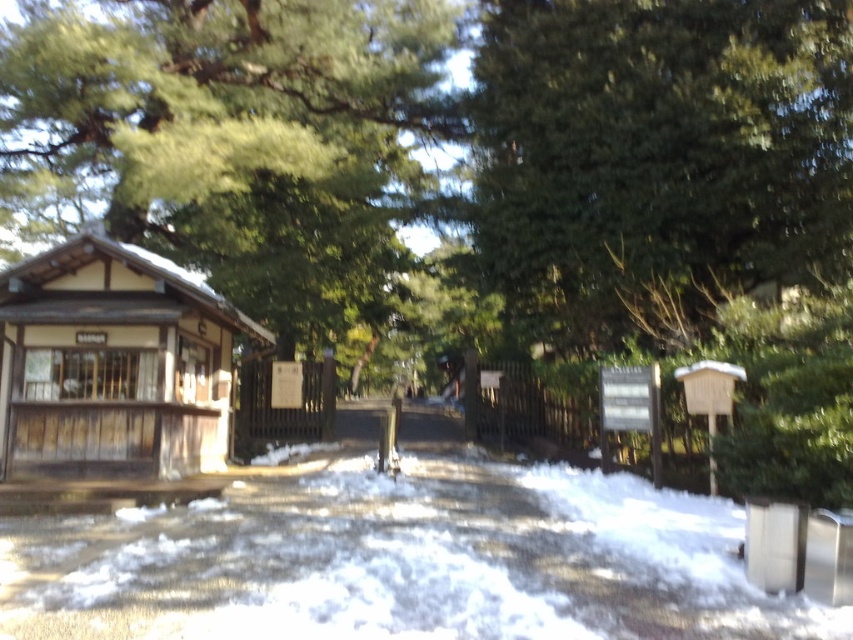
Is point (61, 632) closer to viewer compared to point (26, 428)?

Yes, it is in front of point (26, 428).

This screenshot has height=640, width=853. I want to click on white fluffy snow at center, so click(x=402, y=563).

Between point (434, 515) and point (59, 420), which one is positioned behind?

The point (59, 420) is behind.

At what (x,y) coordinates should I click in order to perform the action: click on white fluffy snow at center. Please return your answer as a coordinate pair (x, y). This screenshot has height=640, width=853. Looking at the image, I should click on (402, 563).